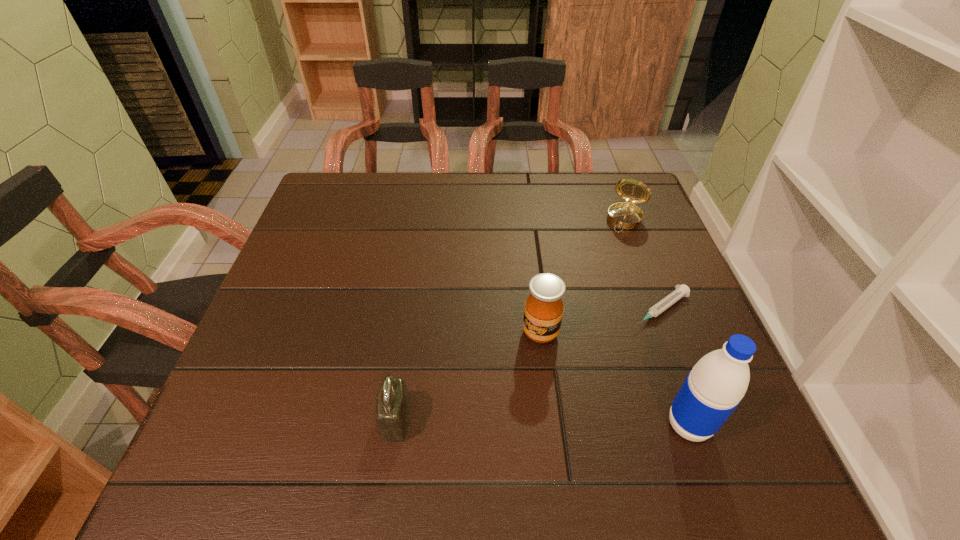
Where is `padlock`? padlock is located at coordinates (393, 404).

Locate an element on the screen. water bottle is located at coordinates (715, 386).

I want to click on the farthest object, so click(626, 215).

The width and height of the screenshot is (960, 540). I want to click on syringe, so click(x=682, y=290).

Image resolution: width=960 pixels, height=540 pixels. What are the coordinates of `the second object from left to right` in the screenshot? It's located at (543, 312).

Locate an element on the screen. the fourth shortest object is located at coordinates (543, 312).

Where is `vacant region located 0.290m at the front of the leftmost object near the keyhole`? vacant region located 0.290m at the front of the leftmost object near the keyhole is located at coordinates (219, 420).

At what (x,y) coordinates should I click in order to perform the action: click on free spot located at the front of the leftmost object near the keyhole. Please return your answer as a coordinate pair (x, y). Looking at the image, I should click on (276, 420).

The height and width of the screenshot is (540, 960). I want to click on vacant point located 0.180m at the front of the leftmost object near the keyhole, so click(x=280, y=420).

This screenshot has height=540, width=960. Find the location of `free location located on the back of the tallest object`. free location located on the back of the tallest object is located at coordinates (668, 367).